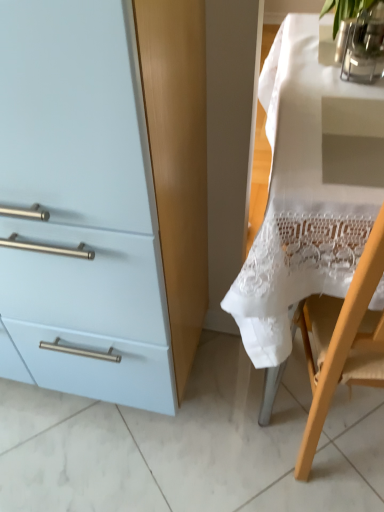
Question: Can you confirm if white lace tablecloth at right is thinner than clear glass vase at upper right, the 2th glass vase from the front?

Choices:
 (A) no
 (B) yes

Answer: (A)

Question: Considering the relative positions of white lace tablecloth at right and clear glass vase at upper right, marked as the first glass vase in a back-to-front arrangement, in the image provided, is white lace tablecloth at right to the left of clear glass vase at upper right, marked as the first glass vase in a back-to-front arrangement, from the viewer's perspective?

Choices:
 (A) yes
 (B) no

Answer: (B)

Question: From the image's perspective, is white lace tablecloth at right located above clear glass vase at upper right, the 2th glass vase from the front?

Choices:
 (A) yes
 (B) no

Answer: (B)

Question: Considering the relative sizes of white lace tablecloth at right and clear glass vase at upper right, the 2th glass vase from the front, in the image provided, is white lace tablecloth at right bigger than clear glass vase at upper right, the 2th glass vase from the front,?

Choices:
 (A) yes
 (B) no

Answer: (A)

Question: Could clear glass vase at upper right, marked as the first glass vase in a back-to-front arrangement, be considered to be inside white lace tablecloth at right?

Choices:
 (A) no
 (B) yes

Answer: (B)

Question: Is white lace tablecloth at right with clear glass vase at upper right, marked as the first glass vase in a back-to-front arrangement?

Choices:
 (A) yes
 (B) no

Answer: (B)

Question: Is light blue matte cabinet at left bigger than clear glass vase at upper right, the second glass vase positioned from the back?

Choices:
 (A) no
 (B) yes

Answer: (B)

Question: Does light blue matte cabinet at left have a lesser width compared to clear glass vase at upper right, which is counted as the 1th glass vase, starting from the front?

Choices:
 (A) no
 (B) yes

Answer: (A)

Question: Is light blue matte cabinet at left aimed at clear glass vase at upper right, the second glass vase positioned from the back?

Choices:
 (A) no
 (B) yes

Answer: (A)

Question: Does light blue matte cabinet at left come in front of clear glass vase at upper right, which is counted as the 1th glass vase, starting from the front?

Choices:
 (A) no
 (B) yes

Answer: (B)

Question: Can clear glass vase at upper right, the second glass vase positioned from the back, be found inside light blue matte cabinet at left?

Choices:
 (A) no
 (B) yes

Answer: (A)

Question: Is light blue matte cabinet at left wider than clear glass vase at upper right, the second glass vase positioned from the back?

Choices:
 (A) yes
 (B) no

Answer: (A)

Question: Is white lace tablecloth at right positioned with its back to clear glass vase at upper right, which is counted as the 1th glass vase, starting from the front?

Choices:
 (A) no
 (B) yes

Answer: (A)